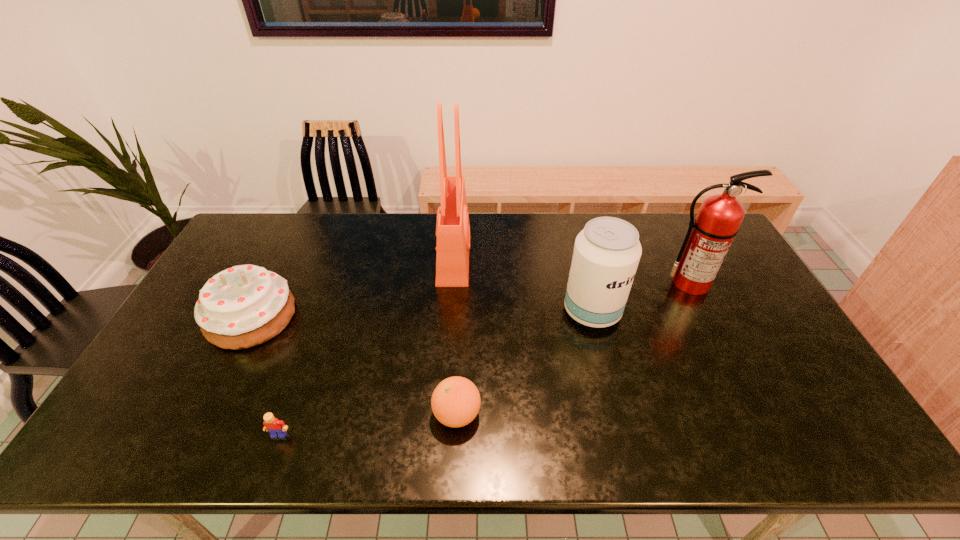
You are a GUI agent. You are given a task and a screenshot of the screen. Output one action in this format:
    pyautogui.click(x=<x>, y=<y>)
    Task: Click on the vacant position at the far edge of the desktop
    Image resolution: width=960 pixels, height=540 pixels.
    Given the screenshot: What is the action you would take?
    pyautogui.click(x=608, y=213)

In the image, there is a desktop. Where is `blank space at the near edge`? blank space at the near edge is located at coordinates (714, 455).

In order to click on free region at the left edge of the desktop in this screenshot , I will do `click(191, 404)`.

This screenshot has width=960, height=540. What are the coordinates of `blank area at the right edge` in the screenshot? It's located at (722, 301).

Where is `vacant area at the far left corner`? vacant area at the far left corner is located at coordinates (292, 214).

This screenshot has height=540, width=960. In the image, there is a desktop. Identify the location of free space at the near right corner. (825, 440).

You are a GUI agent. You are given a task and a screenshot of the screen. Output one action in this format:
    pyautogui.click(x=<x>, y=<y>)
    Task: Click on the free space that is in between the third tallest object and the second object from left to right
    This screenshot has width=960, height=540.
    Given the screenshot: What is the action you would take?
    pyautogui.click(x=436, y=373)

At what (x,y) coordinates should I click in order to perform the action: click on free spot between the fire extinguisher and the Lego. Please return your answer as a coordinate pair (x, y). Looking at the image, I should click on (485, 359).

Locate an element on the screen. free point between the shortest object and the leftmost object is located at coordinates (265, 376).

Locate an element on the screen. The height and width of the screenshot is (540, 960). free spot between the leftmost object and the second object from left to right is located at coordinates (265, 376).